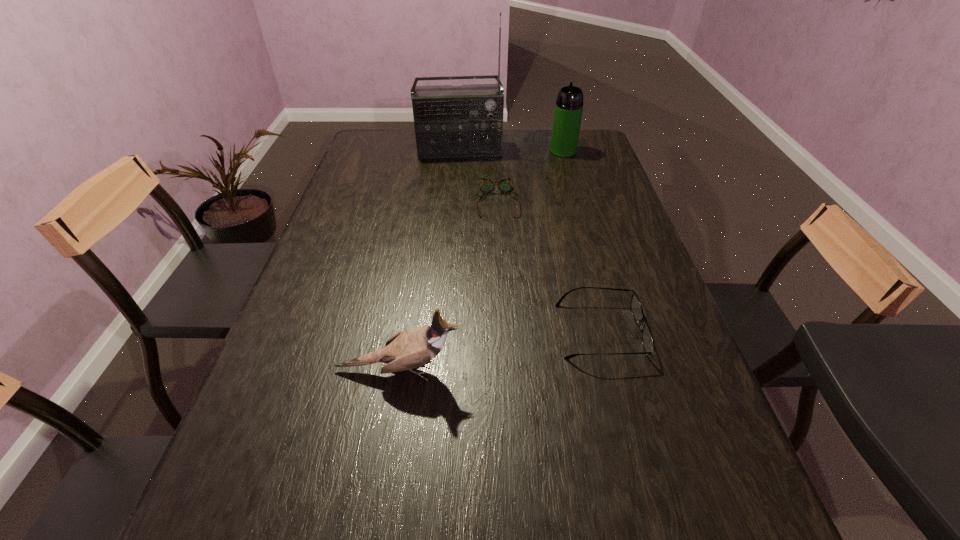
Find the location of a particular element. object that can be found as the fourth closest to the right spectacles is located at coordinates (569, 105).

Locate an element on the screen. The height and width of the screenshot is (540, 960). vacant space that satisfies the following two spatial constraints: 1. on the front side of the farther spectacles; 2. on the right side of the radio receiver is located at coordinates (456, 200).

Locate an element on the screen. The image size is (960, 540). vacant space that satisfies the following two spatial constraints: 1. on the front side of the radio receiver; 2. on the front-facing side of the right spectacles is located at coordinates (446, 331).